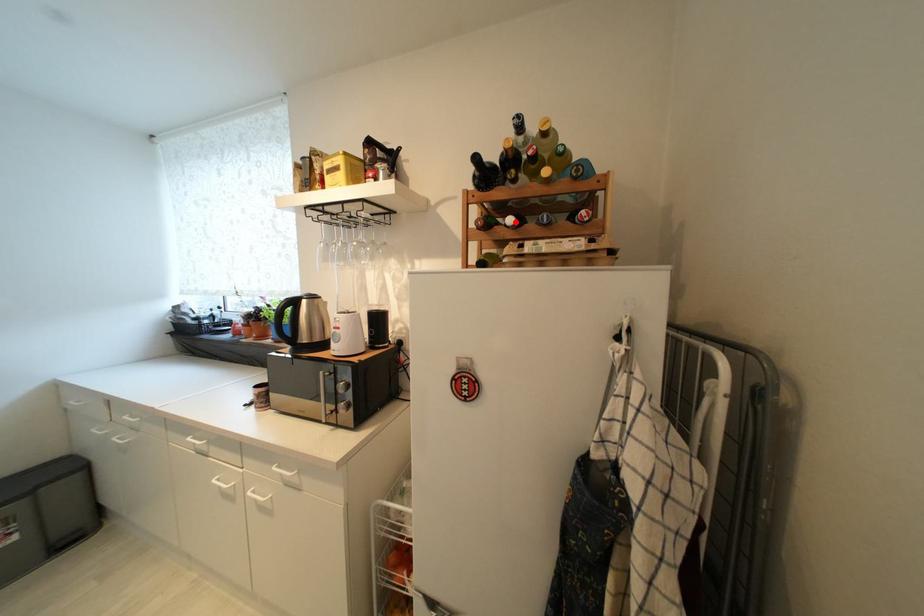
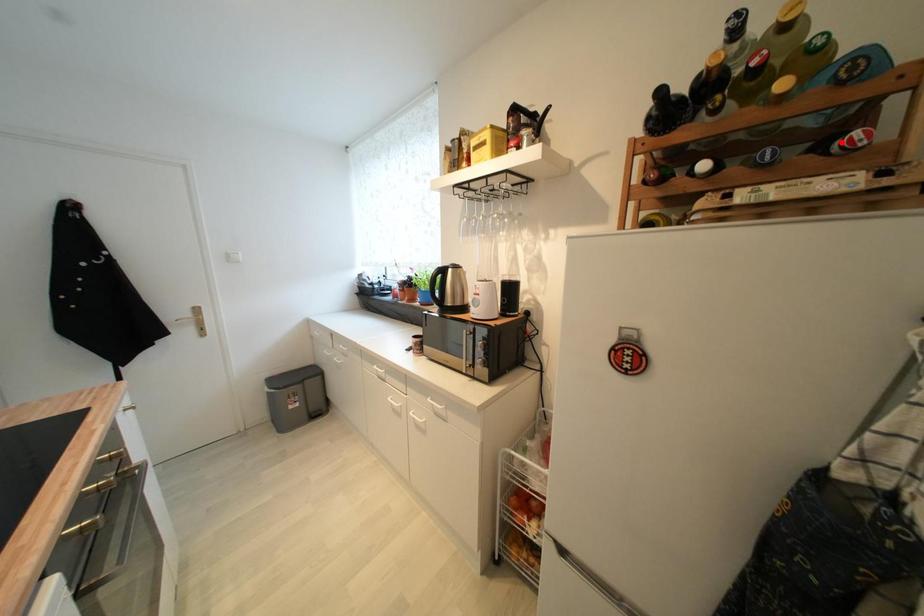
I am providing you with two images of the same scene from different viewpoints. A red point is marked on the first image and another point is marked on the second image. Are the points marked in image1 and image2 representing the same 3D position?

No